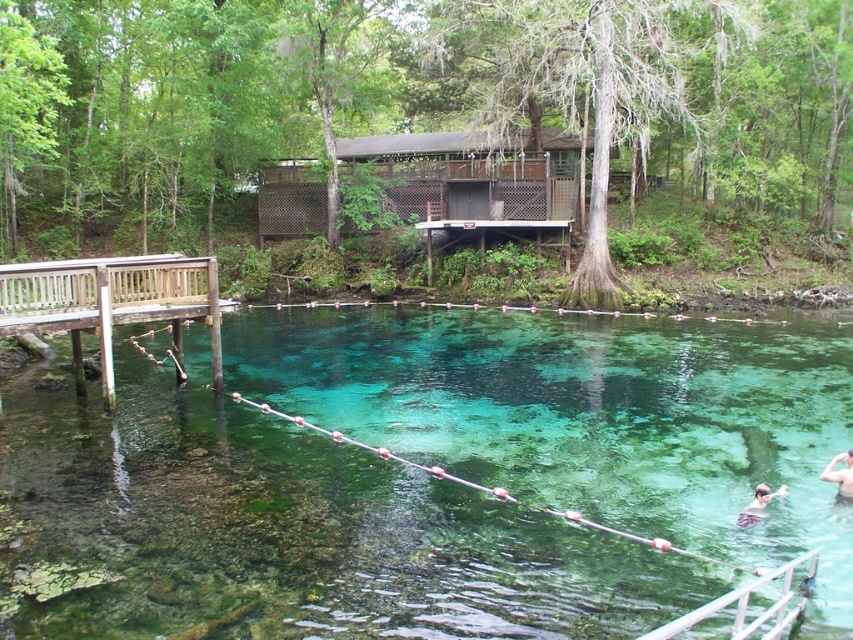
Does clear glass water at center have a larger size compared to smooth skin person at lower right?

Yes.

Does point (306, 349) come in front of point (763, 508)?

No.

Where is `clear glass water at center`? This screenshot has width=853, height=640. clear glass water at center is located at coordinates (286, 531).

From the picture: Does wooden dock at left appear over skinny man at lower right?

Yes, wooden dock at left is above skinny man at lower right.

Does point (194, 289) come behind point (838, 500)?

Yes, it is.

The height and width of the screenshot is (640, 853). What are the coordinates of `wooden dock at left` in the screenshot? It's located at (111, 300).

Is clear glass water at center above wooden dock at left?

Incorrect, clear glass water at center is not positioned above wooden dock at left.

Can you confirm if clear glass water at center is thinner than wooden dock at left?

Incorrect, clear glass water at center's width is not less than wooden dock at left's.

Which is in front, point (596, 321) or point (167, 285)?

Point (167, 285) is more forward.

This screenshot has width=853, height=640. In order to click on clear glass water at center in this screenshot , I will do click(286, 531).